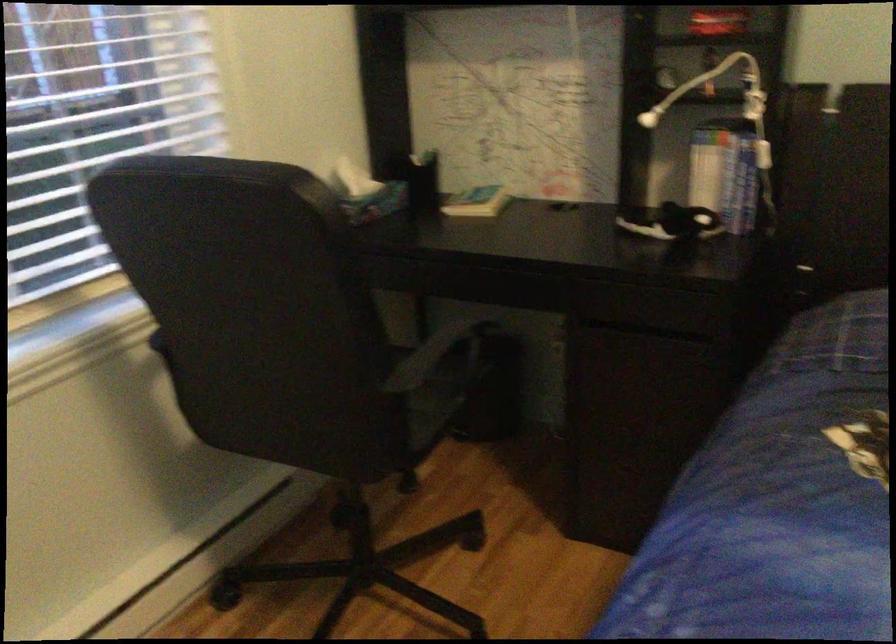
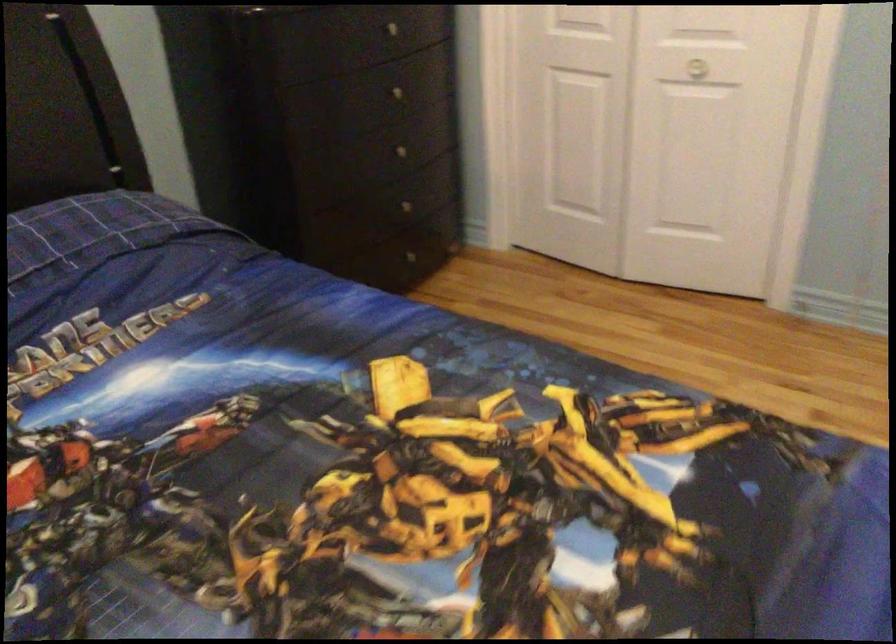
First-person continuous shooting, in which direction is the camera rotating?

The rotation direction of the camera is right-down.